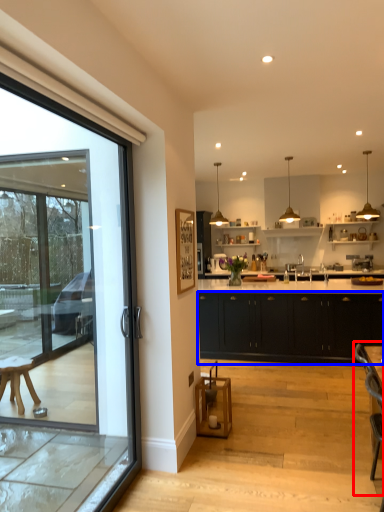
Question: Which object is further to the camera taking this photo, armchair (highlighted by a red box) or cabinetry (highlighted by a blue box)?

Choices:
 (A) armchair
 (B) cabinetry

Answer: (B)